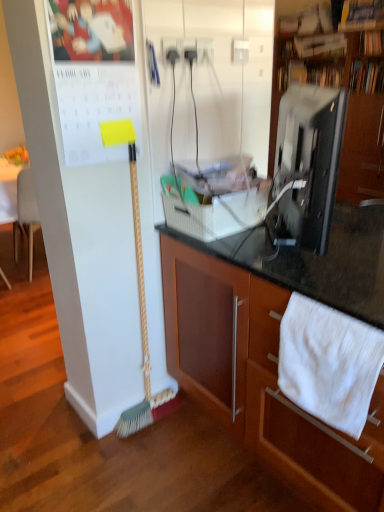
This screenshot has height=512, width=384. I want to click on vacant area that is situated to the right of green bristle broom at left, so click(x=185, y=426).